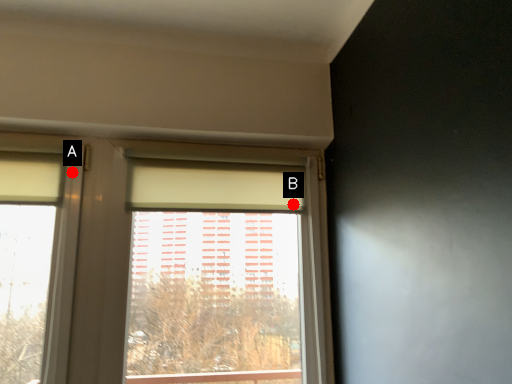
Question: Two points are circled on the image, labeled by A and B beside each circle. Which point is farther to the camera?

Choices:
 (A) A is further
 (B) B is further

Answer: (B)